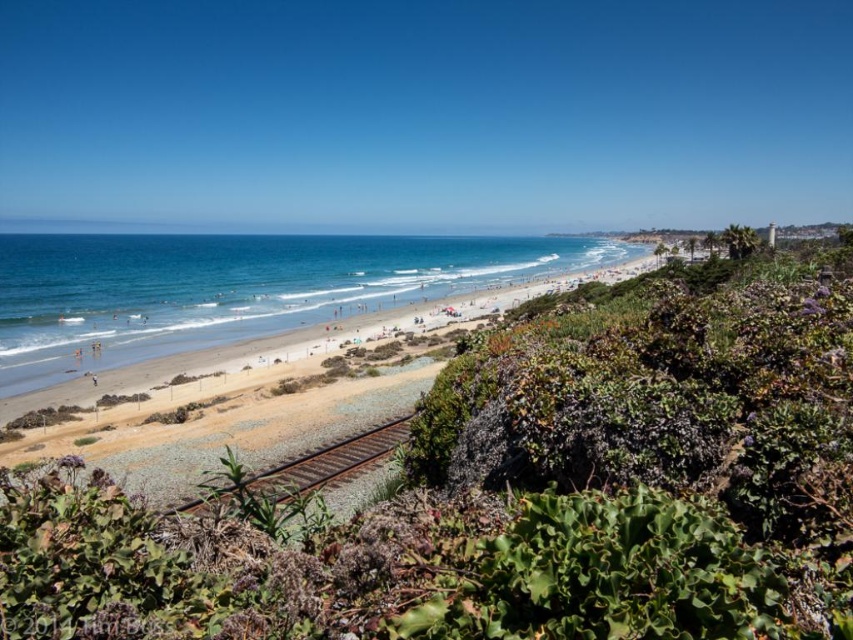
Question: Among these points, which one is farthest from the camera?

Choices:
 (A) (251, 474)
 (B) (181, 388)

Answer: (B)

Question: Can you confirm if brown sand beach at center is smaller than brown gravel train track at center?

Choices:
 (A) no
 (B) yes

Answer: (A)

Question: Can you confirm if brown sand beach at center is positioned to the right of brown gravel train track at center?

Choices:
 (A) yes
 (B) no

Answer: (B)

Question: Can you confirm if brown sand beach at center is positioned below brown gravel train track at center?

Choices:
 (A) no
 (B) yes

Answer: (A)

Question: Which point is farther from the camera taking this photo?

Choices:
 (A) (276, 468)
 (B) (171, 429)

Answer: (B)

Question: Which of the following is the farthest from the observer?

Choices:
 (A) (219, 388)
 (B) (387, 429)

Answer: (A)